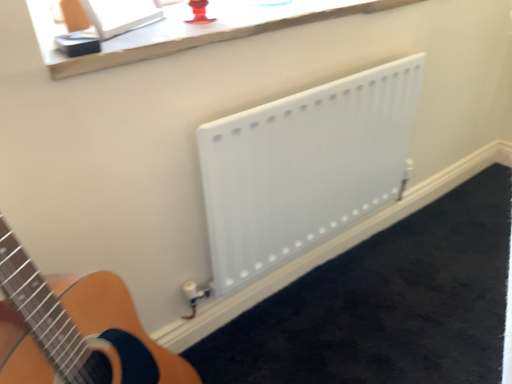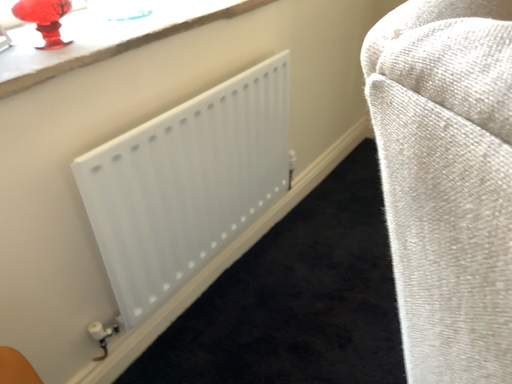
Question: Which way did the camera rotate in the video?

Choices:
 (A) rotated right
 (B) rotated left

Answer: (A)